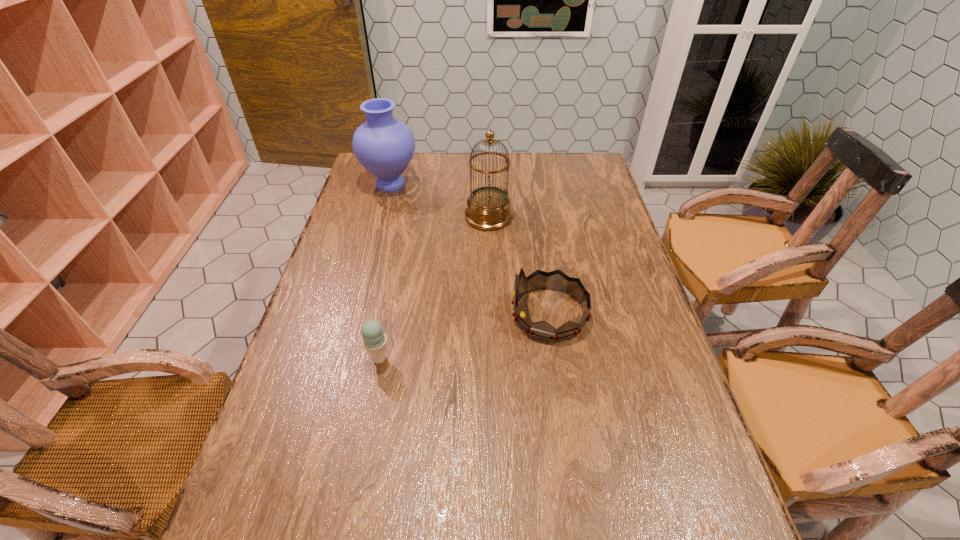
Image resolution: width=960 pixels, height=540 pixels. In order to click on vacant area that lies between the vase and the third farthest object in this screenshot , I will do `click(469, 249)`.

Find the location of a particular element. unoccupied area between the second nearest object and the farthest object is located at coordinates (469, 249).

Locate an element on the screen. This screenshot has width=960, height=540. vacant point located between the nearest object and the tiara is located at coordinates (464, 336).

I want to click on vacant area that lies between the ice cream and the tiara, so click(464, 336).

Where is `vacant area that lies between the ice cream and the farthest object`? This screenshot has height=540, width=960. vacant area that lies between the ice cream and the farthest object is located at coordinates (385, 272).

The image size is (960, 540). Identify the location of unoccupied position between the third farthest object and the ice cream. (464, 336).

At what (x,y) coordinates should I click in order to perform the action: click on free space between the farthest object and the ice cream. Please return your answer as a coordinate pair (x, y). This screenshot has height=540, width=960. Looking at the image, I should click on (385, 272).

The height and width of the screenshot is (540, 960). In order to click on vacant region between the farthest object and the birdcage in this screenshot , I will do `click(440, 200)`.

Find the location of a particular element. Image resolution: width=960 pixels, height=540 pixels. empty space between the ice cream and the farthest object is located at coordinates (385, 272).

Select which object appears as the third closest to the ice cream. Please provide its 2D coordinates. Your answer should be formatted as a tuple, i.e. [(x, y)], where the tuple contains the x and y coordinates of a point satisfying the conditions above.

[(384, 146)]